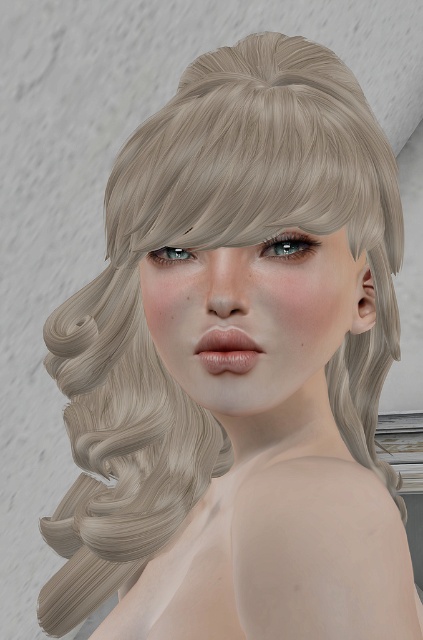
Can you confirm if sleek blonde hair at center is positioned below satin blue eye at center?

Incorrect, sleek blonde hair at center is not positioned below satin blue eye at center.

Find the location of a particular element. The height and width of the screenshot is (640, 423). sleek blonde hair at center is located at coordinates (257, 157).

Does sleek blonde hair at center have a greater height compared to satin blue eye at upper center?

Yes, sleek blonde hair at center is taller than satin blue eye at upper center.

Is sleek blonde hair at center below satin blue eye at upper center?

Actually, sleek blonde hair at center is above satin blue eye at upper center.

Locate an element on the screen. sleek blonde hair at center is located at coordinates (257, 157).

Identify the location of sleek blonde hair at center. Image resolution: width=423 pixels, height=640 pixels. (257, 157).

Is satin blue eye at center bigger than satin blue eye at upper center?

Correct, satin blue eye at center is larger in size than satin blue eye at upper center.

Who is more distant from viewer, (307,237) or (151,257)?

Positioned behind is point (151,257).

Locate an element on the screen. The height and width of the screenshot is (640, 423). satin blue eye at center is located at coordinates (288, 244).